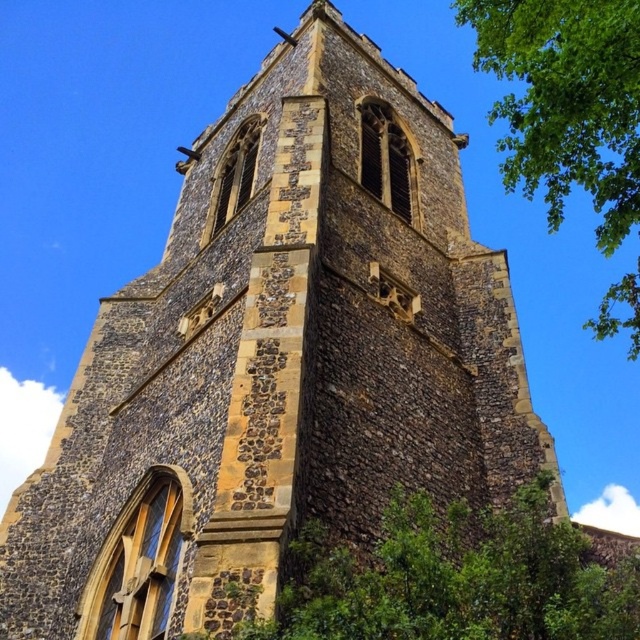
Who is taller, green leafy tree at center or green leafy tree at upper right?

With more height is green leafy tree at upper right.

Can you confirm if green leafy tree at center is thinner than green leafy tree at upper right?

Indeed, green leafy tree at center has a lesser width compared to green leafy tree at upper right.

Which is in front, point (513, 637) or point (536, 77)?

Point (513, 637)

Where is `green leafy tree at center`? This screenshot has width=640, height=640. green leafy tree at center is located at coordinates (452, 577).